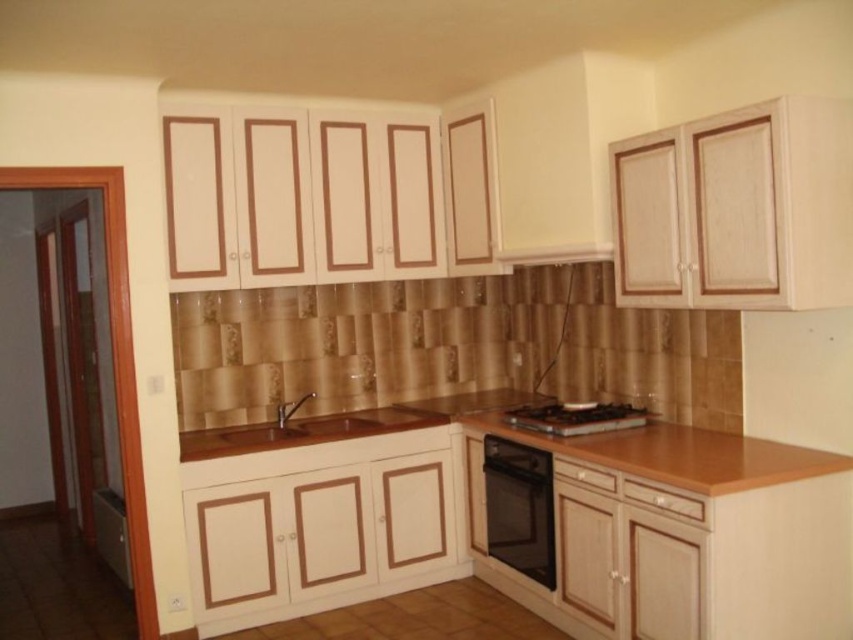
Between wooden countertop at center and wooden at center, which one has more height?

With more height is wooden countertop at center.

Which is in front, point (344, 595) or point (614, 445)?

Positioned in front is point (614, 445).

I want to click on wooden countertop at center, so click(x=556, y=518).

Is point (540, 552) in front of point (614, 406)?

Yes, it is in front of point (614, 406).

Looking at this image, who is taller, black glass oven at lower right or black glass gas stove at center?

black glass oven at lower right is taller.

Identify the location of black glass oven at lower right. This screenshot has height=640, width=853. [x=519, y=508].

Can you confirm if wooden at center is positioned above black glass oven at lower right?

Yes.

Which is more to the right, wooden at center or black glass oven at lower right?

From the viewer's perspective, wooden at center appears more on the right side.

At what (x,y) coordinates should I click in order to perform the action: click on wooden at center. Please return your answer as a coordinate pair (x, y). Looking at the image, I should click on (648, 445).